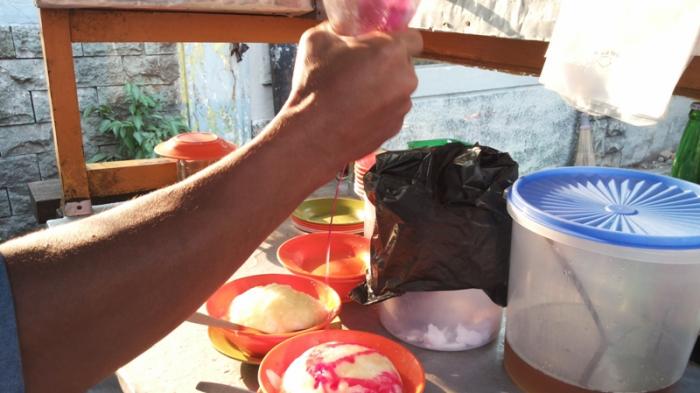
The image size is (700, 393). I want to click on plant, so click(x=138, y=96), click(x=122, y=109), click(x=122, y=128), click(x=148, y=126), click(x=104, y=123).